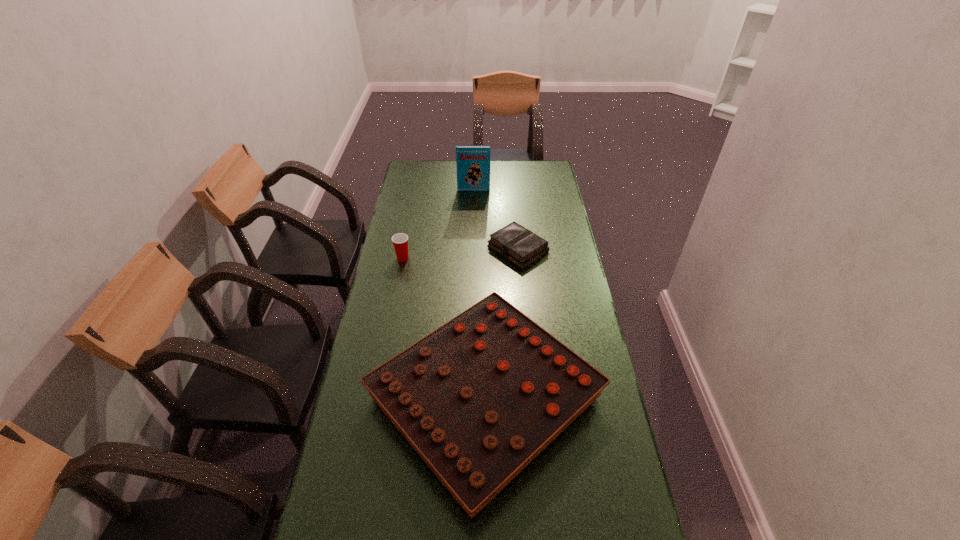
This screenshot has height=540, width=960. In order to click on vacant space in between the farther book and the nearest object in this screenshot , I will do `click(479, 294)`.

The image size is (960, 540). What are the coordinates of `free space that is in between the shortest object and the Dixie cup` in the screenshot? It's located at (461, 253).

Identify which object is the closest to the tallest object. Please provide its 2D coordinates. Your answer should be formatted as a tuple, i.e. [(x, y)], where the tuple contains the x and y coordinates of a point satisfying the conditions above.

[(514, 242)]

Identify the location of the third closest object to the farther book. The height and width of the screenshot is (540, 960). (479, 398).

You are a GUI agent. You are given a task and a screenshot of the screen. Output one action in this format:
    pyautogui.click(x=<x>, y=<y>)
    Task: Click on the free space in the image that satisfies the following two spatial constraints: 1. on the front cover of the tallest object; 2. on the left side of the shorter book
    
    Given the screenshot: What is the action you would take?
    pyautogui.click(x=472, y=249)

Image resolution: width=960 pixels, height=540 pixels. Identify the location of free location that satisfies the following two spatial constraints: 1. on the front cover of the farther book; 2. on the right side of the nearest object. (469, 398).

This screenshot has height=540, width=960. Identify the location of free space that satisfies the following two spatial constraints: 1. on the front cover of the shortest object; 2. on the right side of the farther book. (472, 249).

Where is `vacant space that satisfies the following two spatial constraints: 1. on the front cover of the gameboard; 2. on the left side of the farther book`? vacant space that satisfies the following two spatial constraints: 1. on the front cover of the gameboard; 2. on the left side of the farther book is located at coordinates (469, 398).